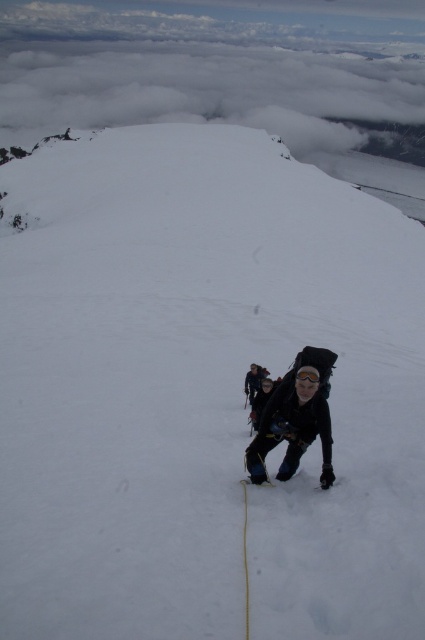
Question: Does black matte jacket at center have a larger size compared to matte black backpack at center?

Choices:
 (A) no
 (B) yes

Answer: (B)

Question: Which of the following is the farthest from the observer?

Choices:
 (A) (308, 396)
 (B) (246, 561)
 (C) (255, 365)

Answer: (C)

Question: Among these points, which one is farthest from the camera?

Choices:
 (A) (249, 378)
 (B) (291, 474)

Answer: (A)

Question: Considering the relative positions of black matte jacket at center and matte black backpack at center in the image provided, where is black matte jacket at center located with respect to matte black backpack at center?

Choices:
 (A) above
 (B) below

Answer: (B)

Question: Is white nylon rope at center positioned at the back of matte black backpack at center?

Choices:
 (A) yes
 (B) no

Answer: (B)

Question: Which object appears farthest from the camera in this image?

Choices:
 (A) white nylon rope at center
 (B) black matte jacket at center
 (C) matte black backpack at center

Answer: (C)